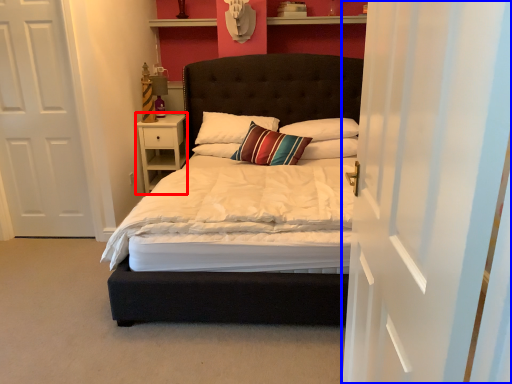
Question: Among these objects, which one is nearest to the camera, nightstand (highlighted by a red box) or curtain (highlighted by a blue box)?

Choices:
 (A) nightstand
 (B) curtain

Answer: (B)